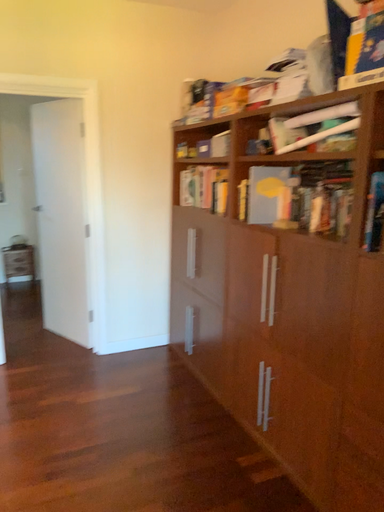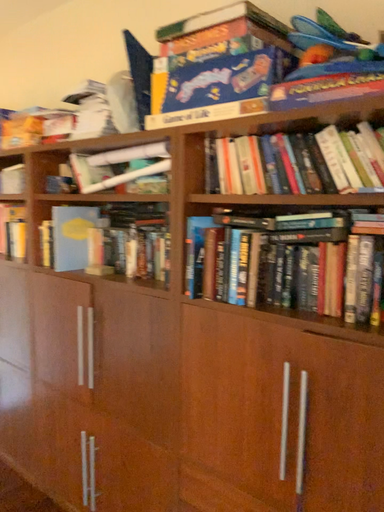
Question: How did the camera likely rotate when shooting the video?

Choices:
 (A) rotated right
 (B) rotated left

Answer: (A)